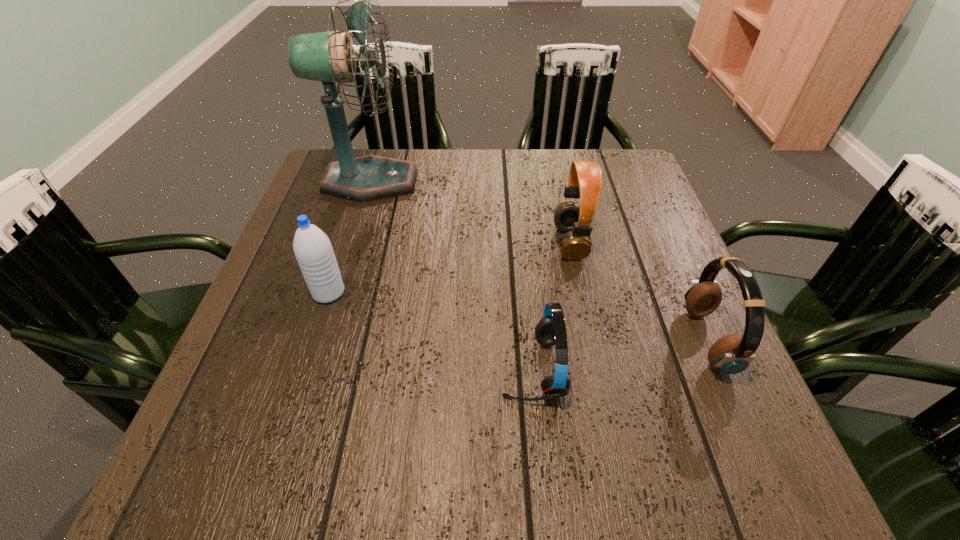
Find the location of a particular element. fan situated at the left edge is located at coordinates (329, 57).

At what (x,y) coordinates should I click in order to perform the action: click on water bottle that is at the left edge. Please return your answer as a coordinate pair (x, y). Image resolution: width=960 pixels, height=540 pixels. Looking at the image, I should click on (312, 248).

The height and width of the screenshot is (540, 960). I want to click on object present at the right edge, so click(731, 354).

Locate an element on the screen. This screenshot has width=960, height=540. object located in the far left corner section of the desktop is located at coordinates (329, 57).

You are a GUI agent. You are given a task and a screenshot of the screen. Output one action in this format:
    pyautogui.click(x=<x>, y=<y>)
    Task: Click on the vacant space at the far edge of the desktop
    This screenshot has height=540, width=960.
    Given the screenshot: What is the action you would take?
    [467, 154]

Identify the location of vacant space at the near edge of the desktop. This screenshot has height=540, width=960. (636, 468).

In the image, there is a desktop. Where is `free space at the left edge`? free space at the left edge is located at coordinates (294, 225).

This screenshot has width=960, height=540. Identify the location of vacant space at the right edge. (624, 246).

Image resolution: width=960 pixels, height=540 pixels. In order to click on free space at the far left corner of the desktop in this screenshot , I will do 313,185.

Where is `vacant space at the near left corner of the desktop`? The image size is (960, 540). vacant space at the near left corner of the desktop is located at coordinates (285, 455).